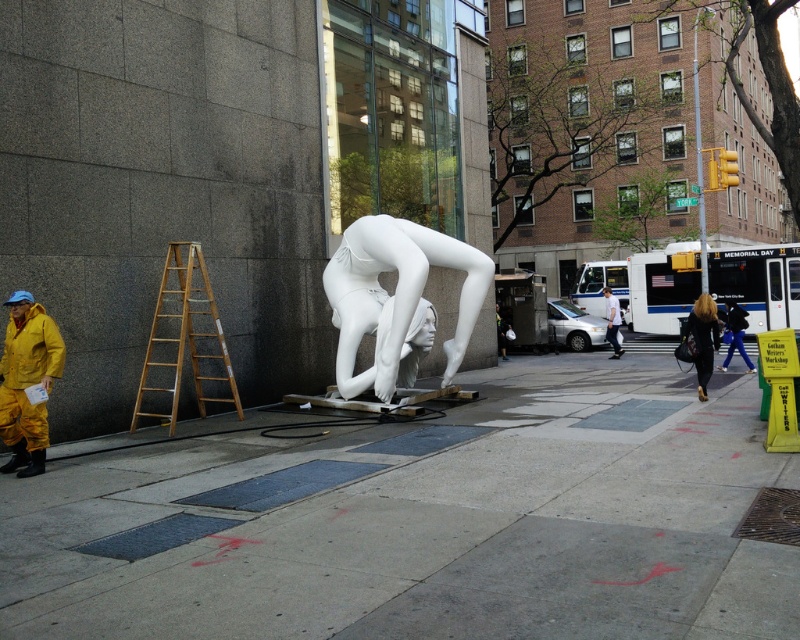
Is wooden ladder at left bigger than black leather jacket at center?

Correct, wooden ladder at left is larger in size than black leather jacket at center.

Which is behind, point (204, 314) or point (696, 358)?

The point (696, 358) is more distant.

This screenshot has height=640, width=800. Identify the location of wooden ladder at left. (184, 337).

Who is taller, black leather jacket at center or white matte mannequin at center?

white matte mannequin at center

Who is higher up, black leather jacket at center or white matte mannequin at center?

white matte mannequin at center is above.

I want to click on black leather jacket at center, so click(x=704, y=339).

In the scene shown: Is yellow matte jacket at lower left wider than black leather jacket at center?

Yes, yellow matte jacket at lower left is wider than black leather jacket at center.

Which is below, yellow matte jacket at lower left or black leather jacket at center?

Positioned lower is yellow matte jacket at lower left.

Does point (14, 298) lie in front of point (704, 330)?

Yes, point (14, 298) is closer to viewer.

Identify the location of yellow matte jacket at lower left. This screenshot has height=640, width=800. (28, 381).